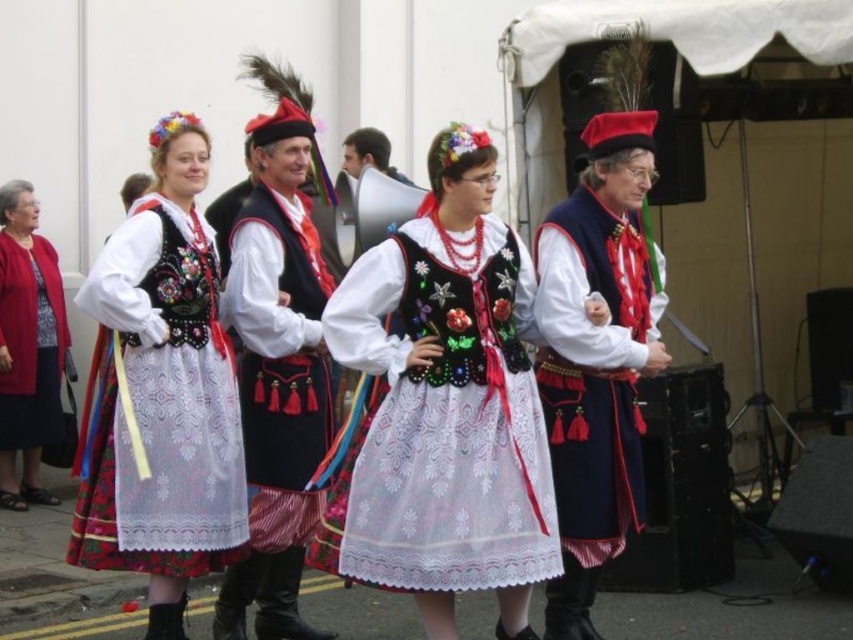
Is point (242, 268) closer to camera compared to point (16, 481)?

Yes, it is.

Which is behind, point (312, 461) or point (61, 300)?

The point (61, 300) is more distant.

The height and width of the screenshot is (640, 853). I want to click on matte black vest at center, so click(277, 360).

Which is behind, point (99, 445) or point (630, 480)?

The point (630, 480) is behind.

Does matte black dress at center have a greater height compared to velvet dark blue vest at center?

No.

Identify the location of matte black dress at center. This screenshot has height=640, width=853. (160, 392).

Who is lower down, embroidered fabric dress at center or velvet dark blue vest at center?

Positioned lower is embroidered fabric dress at center.

Which is more to the right, embroidered fabric dress at center or velvet dark blue vest at center?

velvet dark blue vest at center

Does point (430, 557) come behind point (544, 296)?

No, it is in front of (544, 296).

You are a GUI agent. You are given a task and a screenshot of the screen. Output one action in this format:
    pyautogui.click(x=<x>, y=<y>)
    Task: Click on the embroidered fabric dress at center
    Image resolution: width=853 pixels, height=640 pixels.
    Given the screenshot: What is the action you would take?
    pyautogui.click(x=448, y=403)